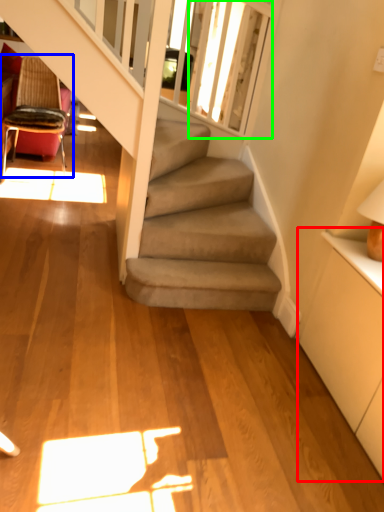
Question: Which object is positioned farthest from dresser (highlighted by a red box)? Select from chair (highlighted by a blue box) and window screen (highlighted by a green box).

Choices:
 (A) chair
 (B) window screen

Answer: (A)